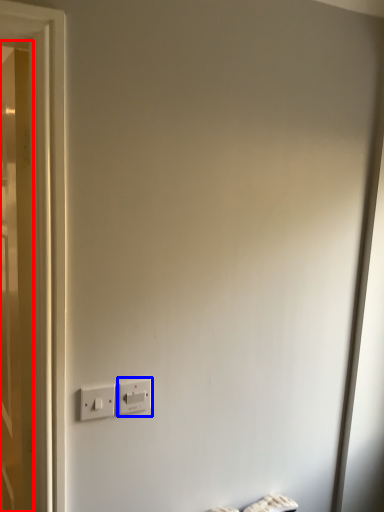
Question: Which object is further to the camera taking this photo, door (highlighted by a red box) or power plugs and sockets (highlighted by a blue box)?

Choices:
 (A) door
 (B) power plugs and sockets

Answer: (B)